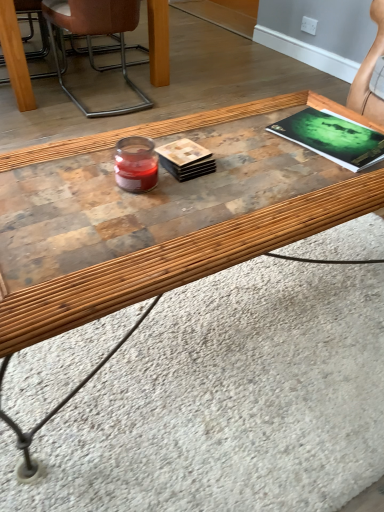
Question: Considering the relative positions of green matte magazine at upper right and brown leather chair at upper left in the image provided, is green matte magazine at upper right to the left of brown leather chair at upper left from the viewer's perspective?

Choices:
 (A) yes
 (B) no

Answer: (B)

Question: Considering the relative positions of green matte magazine at upper right and brown leather chair at upper left in the image provided, is green matte magazine at upper right in front of brown leather chair at upper left?

Choices:
 (A) yes
 (B) no

Answer: (A)

Question: Is green matte magazine at upper right positioned behind brown leather chair at upper left?

Choices:
 (A) yes
 (B) no

Answer: (B)

Question: Is green matte magazine at upper right facing away from brown leather chair at upper left?

Choices:
 (A) no
 (B) yes

Answer: (A)

Question: From a real-world perspective, is green matte magazine at upper right beneath brown leather chair at upper left?

Choices:
 (A) no
 (B) yes

Answer: (A)

Question: Is brown leather chair at upper left a part of green matte magazine at upper right?

Choices:
 (A) yes
 (B) no

Answer: (B)

Question: Considering the relative sizes of brown leather chair at upper left and green matte magazine at upper right in the image provided, is brown leather chair at upper left shorter than green matte magazine at upper right?

Choices:
 (A) yes
 (B) no

Answer: (B)

Question: Is brown leather chair at upper left closer to camera compared to green matte magazine at upper right?

Choices:
 (A) yes
 (B) no

Answer: (B)

Question: Is brown leather chair at upper left to the left of green matte magazine at upper right from the viewer's perspective?

Choices:
 (A) yes
 (B) no

Answer: (A)

Question: Considering the relative positions of brown leather chair at upper left and green matte magazine at upper right in the image provided, is brown leather chair at upper left to the right of green matte magazine at upper right from the viewer's perspective?

Choices:
 (A) no
 (B) yes

Answer: (A)

Question: Considering the relative sizes of brown leather chair at upper left and green matte magazine at upper right in the image provided, is brown leather chair at upper left thinner than green matte magazine at upper right?

Choices:
 (A) yes
 (B) no

Answer: (B)

Question: Is brown leather chair at upper left positioned with its back to green matte magazine at upper right?

Choices:
 (A) no
 (B) yes

Answer: (B)

Question: Based on their positions, is brown leather chair at upper left located to the left or right of green matte magazine at upper right?

Choices:
 (A) left
 (B) right

Answer: (A)